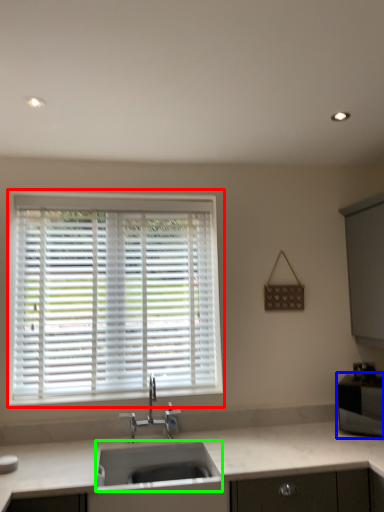
Question: Which is nearer to the window (highlighted by a red box)? appliance (highlighted by a blue box) or sink (highlighted by a green box).

Choices:
 (A) appliance
 (B) sink

Answer: (B)